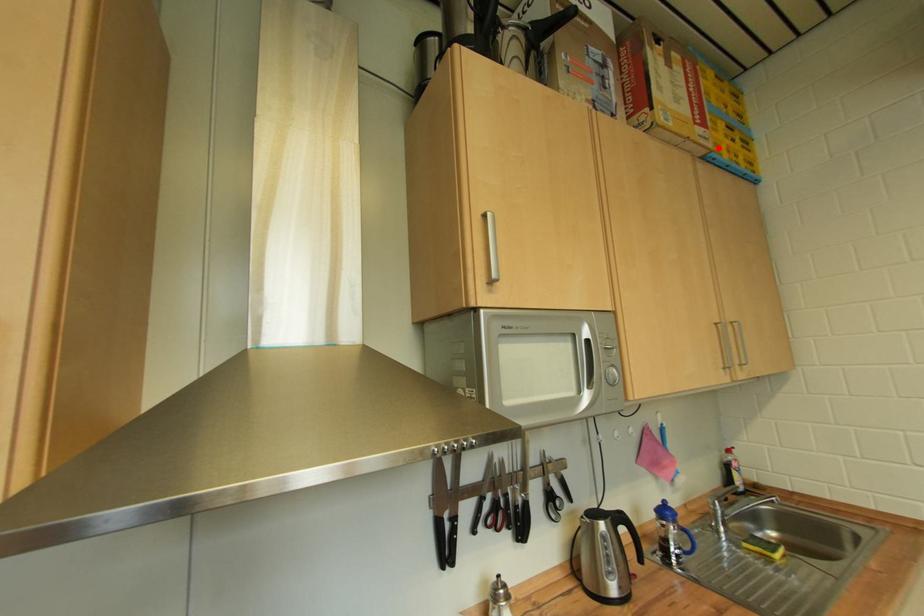
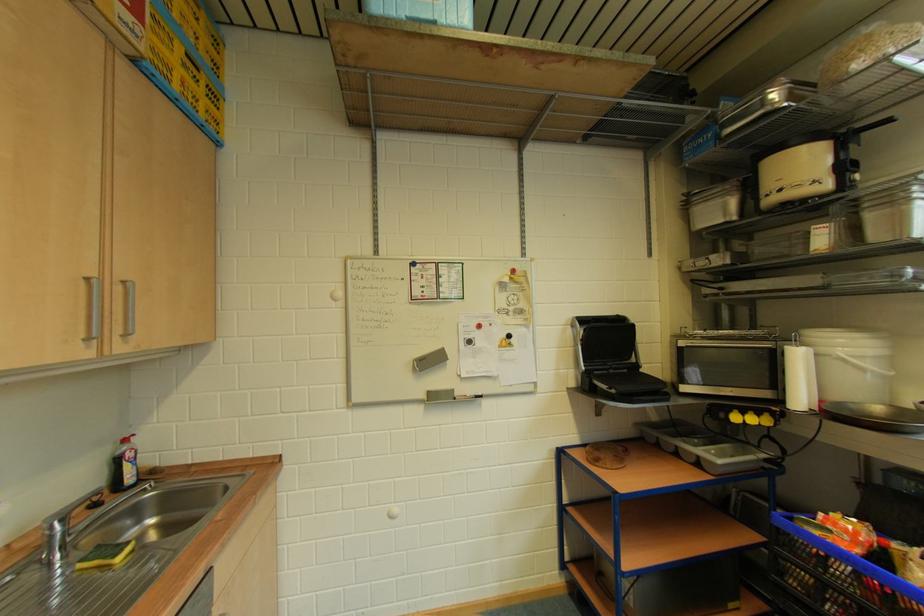
The point at the highlighted location is marked in the first image. Where is the corresponding point in the second image?

(150, 50)